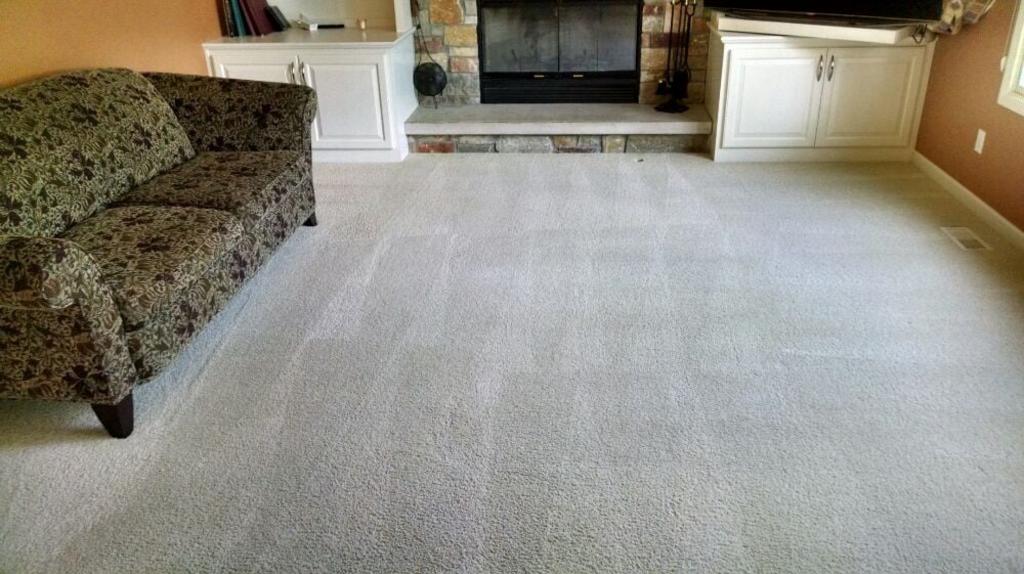
Where is `sofa`? The height and width of the screenshot is (574, 1024). sofa is located at coordinates (157, 274).